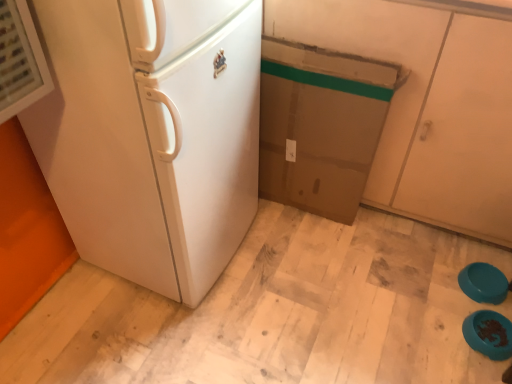
Locate an element on the screen. This screenshot has width=512, height=384. vacant space to the left of teal plastic bowls at lower right, the 2th appliance viewed from the front is located at coordinates (435, 285).